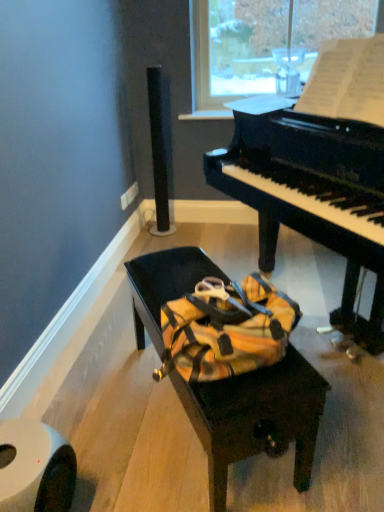
Question: Is point (66, 475) closer or farther from the camera than point (251, 437)?

Choices:
 (A) farther
 (B) closer

Answer: (A)

Question: From the image's perspective, is white matte toilet paper at lower left positioned above or below matte black bench at center?

Choices:
 (A) below
 (B) above

Answer: (A)

Question: Estimate the real-world distances between objects in this image. Which object is closer to the black glossy piano at center?

Choices:
 (A) white matte toilet paper at lower left
 (B) matte black bench at center

Answer: (B)

Question: Which object is positioned closest to the matte black bench at center?

Choices:
 (A) white matte toilet paper at lower left
 (B) black glossy piano at center

Answer: (A)